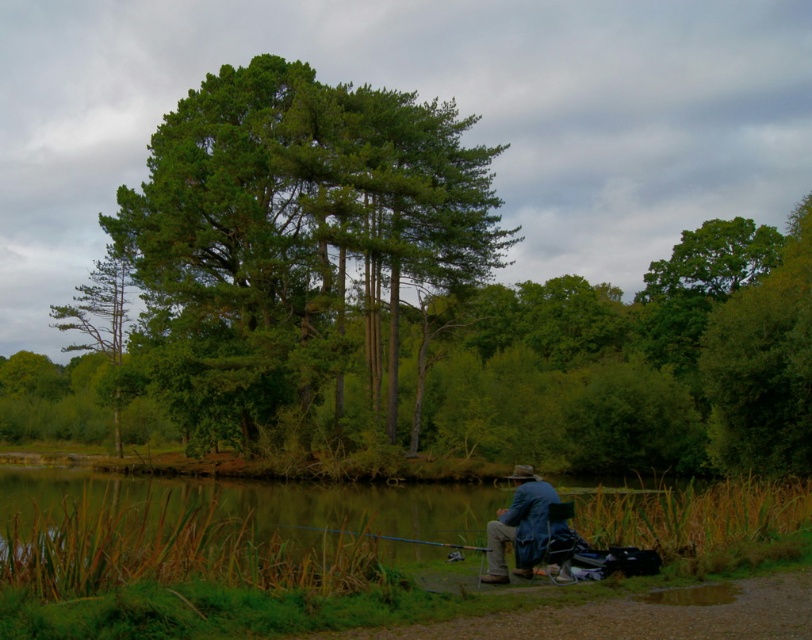
Question: Estimate the real-world distances between objects in this image. Which object is closer to the denim jacket at lower right?

Choices:
 (A) green rough bark tree at left
 (B) green grassy water at lower left
 (C) green leafy tree at center

Answer: (B)

Question: Which object is positioned closest to the green leafy tree at center?

Choices:
 (A) blue metallic fishing pole at center
 (B) denim jacket at lower right
 (C) green grassy water at lower left
 (D) green rough bark tree at left

Answer: (D)

Question: Which is farther from the green grassy water at lower left?

Choices:
 (A) green rough bark tree at left
 (B) denim jacket at lower right
 (C) blue metallic fishing pole at center
 (D) green leafy tree at center

Answer: (B)

Question: Can you confirm if green leafy tree at center is positioned above green grassy water at lower left?

Choices:
 (A) no
 (B) yes

Answer: (B)

Question: Is green rough bark tree at left behind blue metallic fishing pole at center?

Choices:
 (A) no
 (B) yes

Answer: (B)

Question: Can you confirm if green leafy tree at center is positioned to the right of green grassy water at lower left?

Choices:
 (A) yes
 (B) no

Answer: (B)